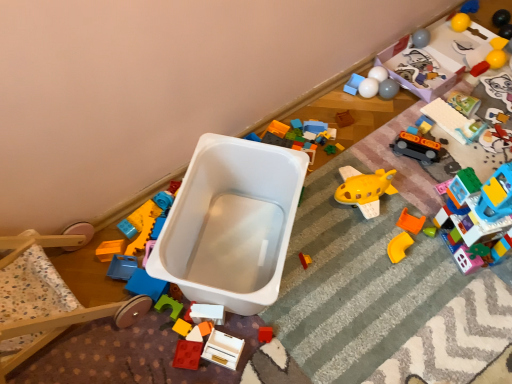
Locate an element on the screen. vacant area that lies between rubberized plastic block at center, the 1th toy positioned from the left, and translucent plastic building blocks at right, positioned as the 12th toy in left-to-right order is located at coordinates (367, 269).